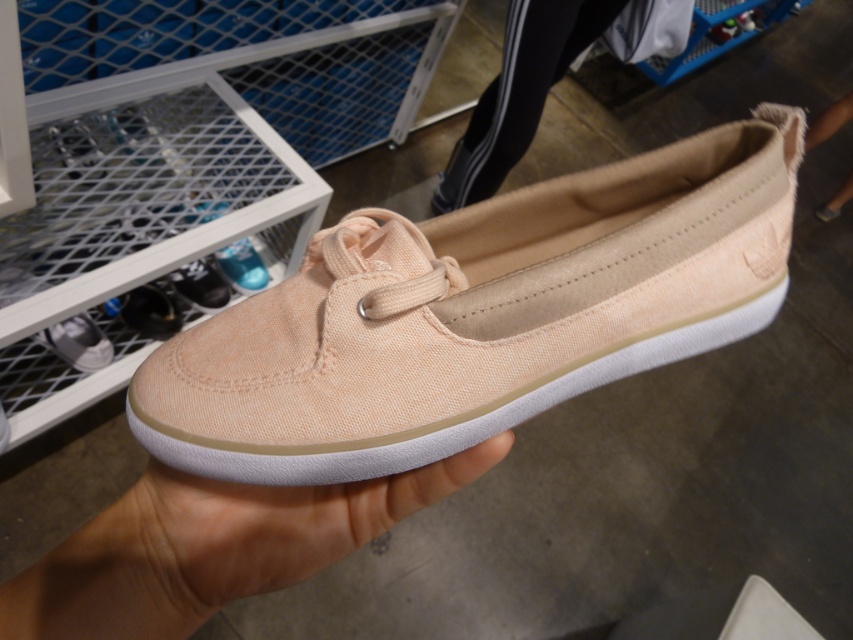
Is light pink canvas shoe at center wider than matte pink canvas shoe at lower center?

Yes.

Who is lower down, light pink canvas shoe at center or matte pink canvas shoe at lower center?

light pink canvas shoe at center is lower down.

Locate an element on the screen. The width and height of the screenshot is (853, 640). light pink canvas shoe at center is located at coordinates (282, 522).

Does peach canvas slip-on at center have a lesser width compared to matte pink canvas shoe at lower center?

No, peach canvas slip-on at center is not thinner than matte pink canvas shoe at lower center.

Can you confirm if peach canvas slip-on at center is smaller than matte pink canvas shoe at lower center?

No, peach canvas slip-on at center is not smaller than matte pink canvas shoe at lower center.

Between point (447, 314) and point (61, 355), which one is positioned in front?

Point (447, 314) is in front.

At what (x,y) coordinates should I click in order to perform the action: click on peach canvas slip-on at center. Please return your answer as a coordinate pair (x, y). The width and height of the screenshot is (853, 640). Looking at the image, I should click on (479, 314).

In the scene shown: How distant is peach canvas slip-on at center from light pink canvas shoe at center?

3.82 inches

Can you confirm if peach canvas slip-on at center is shorter than light pink canvas shoe at center?

Incorrect, peach canvas slip-on at center's height does not fall short of light pink canvas shoe at center's.

Locate an element on the screen. peach canvas slip-on at center is located at coordinates (479, 314).